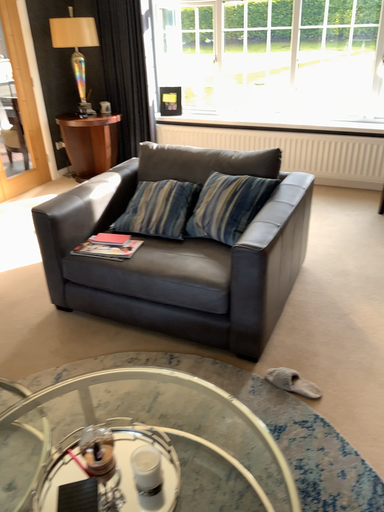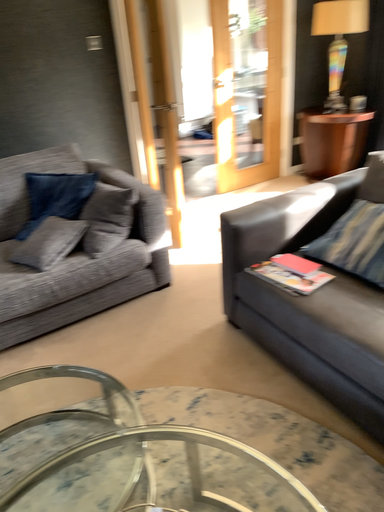
Question: Which way did the camera rotate in the video?

Choices:
 (A) rotated left
 (B) rotated right

Answer: (A)